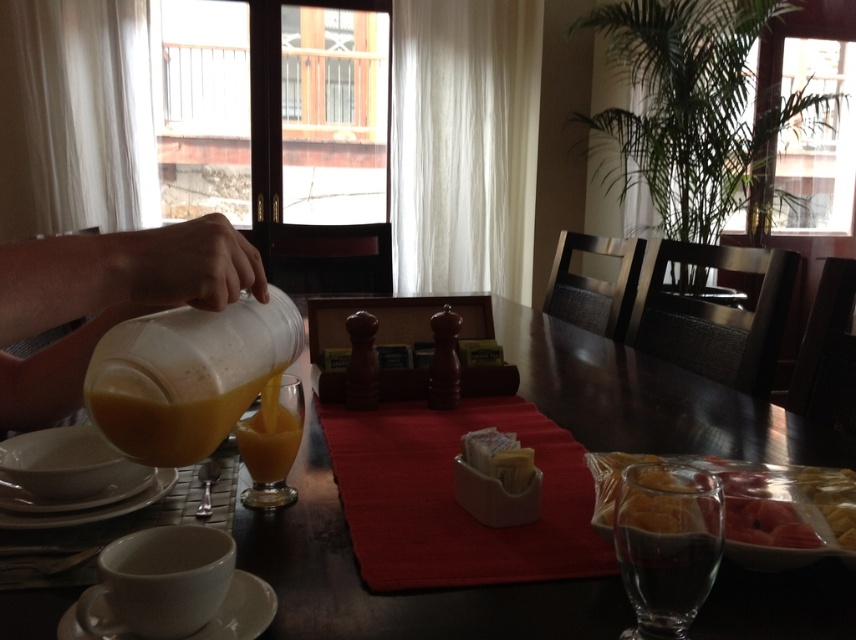
Measure the distance between translucent glass table at center and camera.

They are 18.58 inches apart.

At what (x,y) coordinates should I click in order to perform the action: click on translucent glass table at center. Please return your answer as a coordinate pair (x, y). The image size is (856, 640). Looking at the image, I should click on (400, 593).

Is translucent plastic bag at lower right bigger than white matte plate at lower left?

Yes, translucent plastic bag at lower right is bigger than white matte plate at lower left.

Between translucent plastic bag at lower right and white matte plate at lower left, which one is positioned lower?

white matte plate at lower left

Which is in front, point (819, 476) or point (140, 474)?

Point (819, 476)

Find the location of a particular element. Image resolution: width=856 pixels, height=640 pixels. translucent plastic bag at lower right is located at coordinates (828, 502).

Measure the distance between yellow matte sugar packets at center and camera.

yellow matte sugar packets at center and camera are 25.65 inches apart from each other.

How distant is yellow matte sugar packets at center from white matte plate at lower left?

A distance of 16.45 inches exists between yellow matte sugar packets at center and white matte plate at lower left.

Locate an element on the screen. This screenshot has width=856, height=640. yellow matte sugar packets at center is located at coordinates [498, 458].